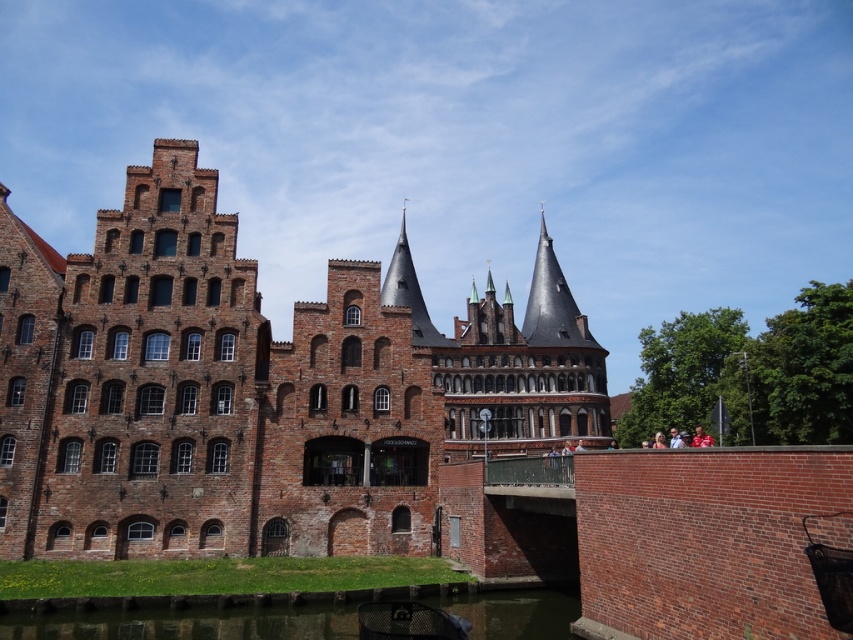
Looking at this image, between brown brick castle at center and green grassy bank at lower left, which one is positioned higher?

brown brick castle at center is higher up.

Where is `brown brick castle at center`? brown brick castle at center is located at coordinates (256, 388).

The height and width of the screenshot is (640, 853). Identify the location of brown brick castle at center. (256, 388).